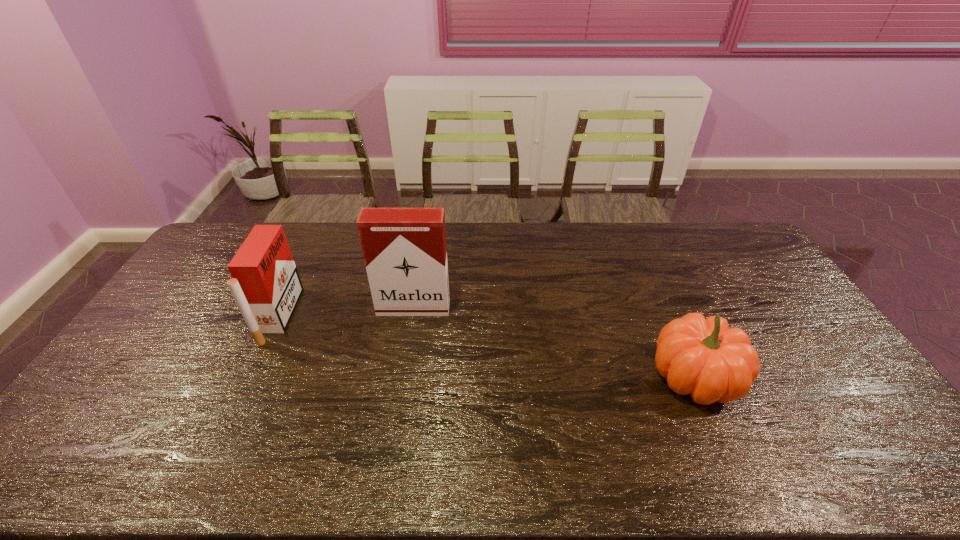
Image resolution: width=960 pixels, height=540 pixels. I want to click on the tallest object, so click(404, 249).

I want to click on the second object from right to left, so click(x=404, y=249).

Find the location of `the shorter cigarette case`. the shorter cigarette case is located at coordinates (265, 284).

The image size is (960, 540). What are the coordinates of `the left cigarette case` in the screenshot? It's located at (265, 284).

What are the coordinates of `pumpkin` in the screenshot? It's located at (702, 357).

In order to click on the shortest object in this screenshot , I will do `click(702, 357)`.

The width and height of the screenshot is (960, 540). In order to click on vacant region located 0.240m on the front-facing side of the taller cigarette case in this screenshot , I will do `click(402, 378)`.

Where is `vacant area located on the front-facing side of the shorter cigarette case`? This screenshot has height=540, width=960. vacant area located on the front-facing side of the shorter cigarette case is located at coordinates (311, 316).

Identify the location of vacant space located on the right of the shortest object. (814, 377).

This screenshot has height=540, width=960. Identify the location of vacant region at the far edge of the desktop. (306, 238).